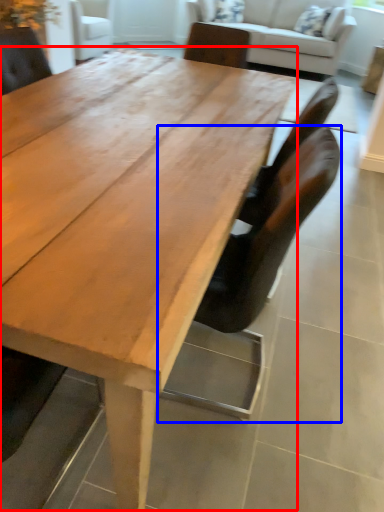
Question: Among these objects, which one is farthest to the camera, coffee table (highlighted by a red box) or chair (highlighted by a blue box)?

Choices:
 (A) coffee table
 (B) chair

Answer: (B)